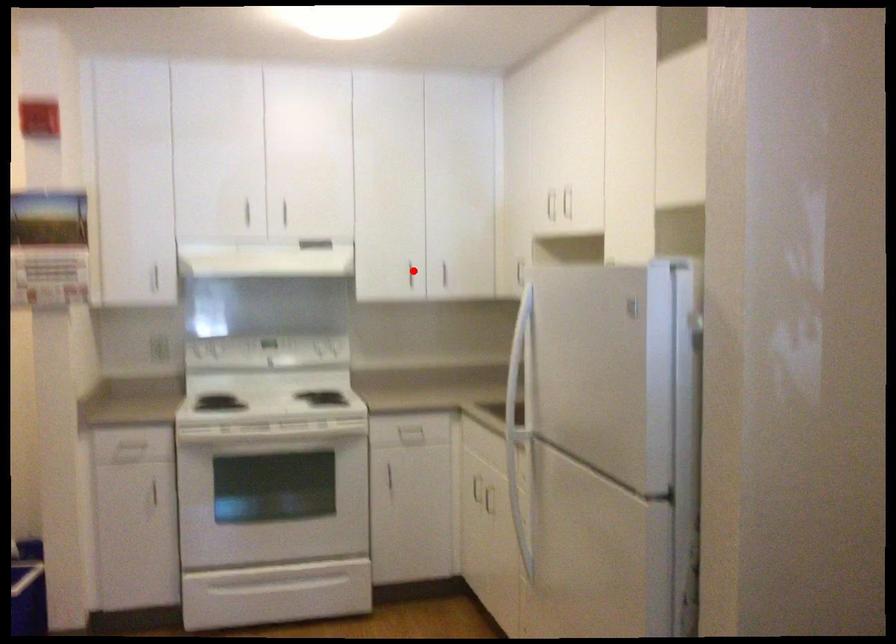
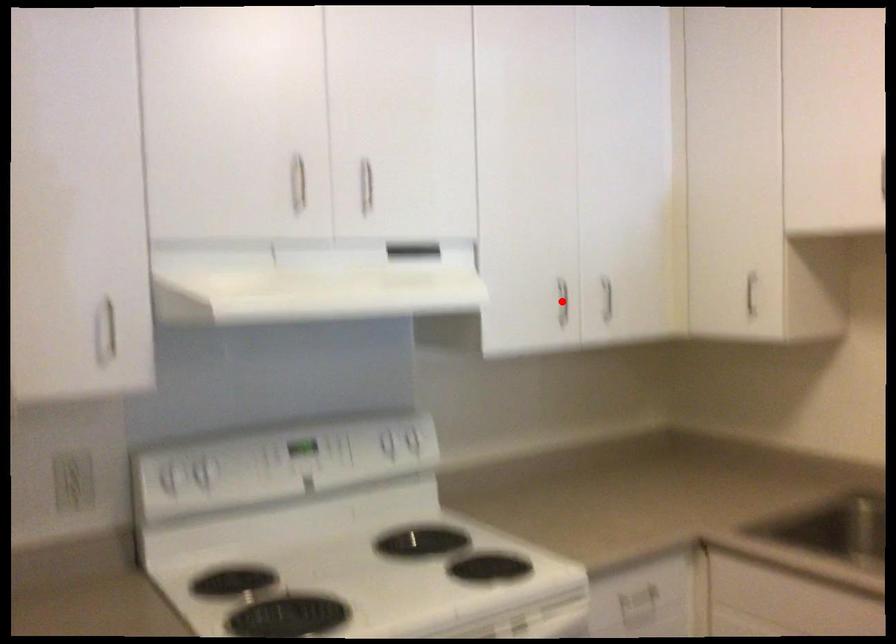
I am providing you with two images of the same scene from different viewpoints. A red point is marked on the first image and another point is marked on the second image. Do the highlighted points in image1 and image2 indicate the same real-world spot?

Yes